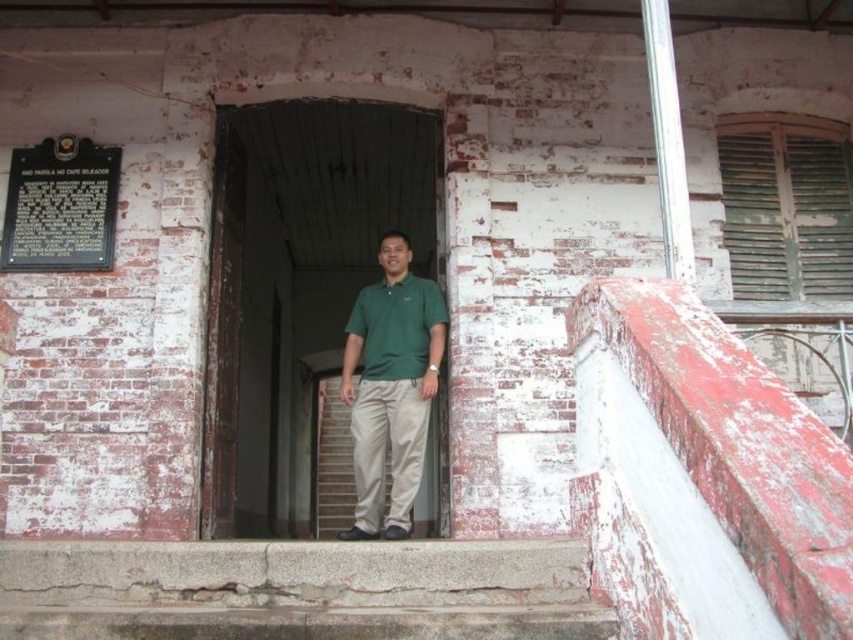
You are trying to decide which green shirt to wear for an outdoor event. You see the green matte shirt at center and the green cotton polo shirt at center in the image. Which one is bigger?

The green matte shirt at center is larger in size than the green cotton polo shirt at center, so you should choose the green matte shirt at center if you want a bigger option.

You are a delivery person trying to enter the building through the wooden door at center. The delivery cart you are pushing is 1.2 meters wide. Can you fit through the door if the black metal plaque at upper left is 0.5 meters wide?

The wooden door at center is wider than the black metal plaque at upper left. Since the plaque is 0.5 meters wide, the door must be wider than that. However, without knowing the exact width of the door, we cannot definitively confirm if it is wider than 1.2 meters. Please measure the door width before attempting to enter.

You are a fashion designer observing a man wearing two green shirts. The outer layer is the green matte shirt at center, and the inner layer is the green cotton polo shirt at center. Can you tell which shirt is visible on top?

The green matte shirt at center is in front of the green cotton polo shirt at center, so the green matte shirt at center is the one visible on top.